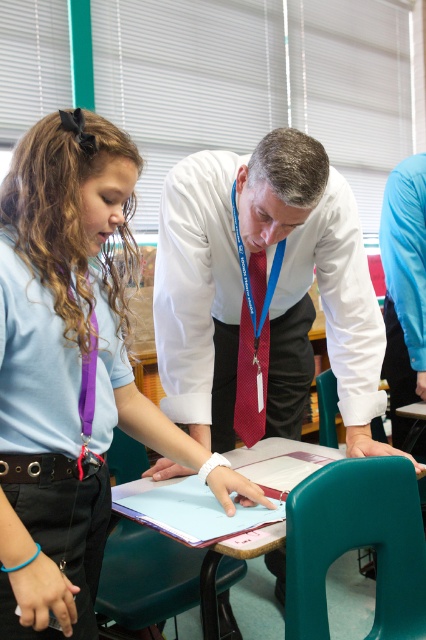
Question: Which point appears farthest from the camera in this image?

Choices:
 (A) (273, 545)
 (B) (126, 141)
 (C) (253, 392)
 (D) (37, 474)

Answer: (C)

Question: Which of the following is the farthest from the observer?

Choices:
 (A) (86, 204)
 (B) (342, 602)
 (C) (25, 476)
 (D) (242, 316)

Answer: (B)

Question: Does white glossy shirt at center appear over green plastic table at center?

Choices:
 (A) no
 (B) yes

Answer: (B)

Question: Which is nearer to the white glossy shirt at center?

Choices:
 (A) shiny red tie at center
 (B) green plastic table at center
 (C) matte blue shirt at center

Answer: (A)

Question: Does white glossy shirt at center appear over shiny red tie at center?

Choices:
 (A) yes
 (B) no

Answer: (A)

Question: Is matte blue shirt at center closer to the viewer compared to white glossy shirt at center?

Choices:
 (A) no
 (B) yes

Answer: (B)